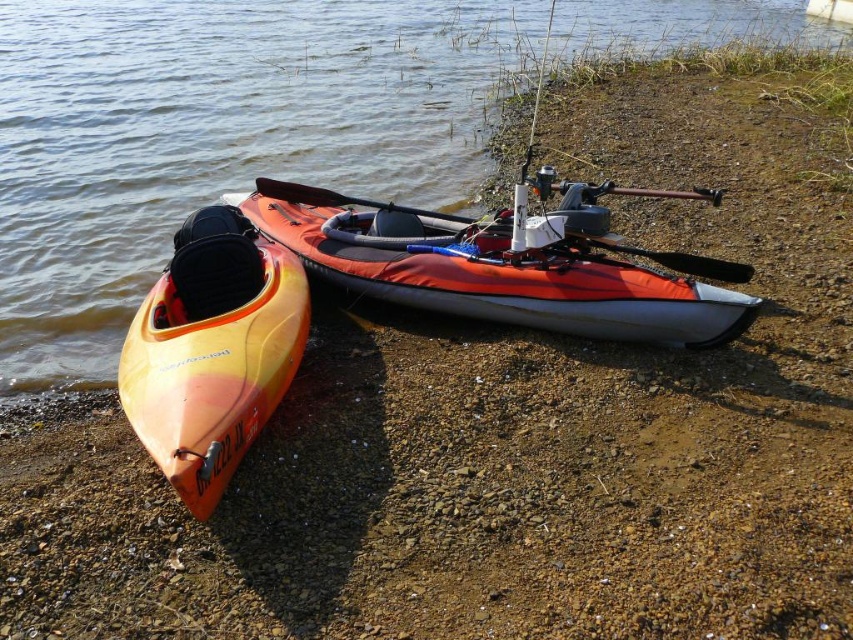
Question: Does orange kayak at lower left appear under orange fabric canoe at center?

Choices:
 (A) no
 (B) yes

Answer: (A)

Question: Observing the image, what is the correct spatial positioning of orange kayak at lower left in reference to orange matte kayak at left?

Choices:
 (A) right
 (B) left

Answer: (B)

Question: Is orange kayak at lower left bigger than orange matte kayak at left?

Choices:
 (A) no
 (B) yes

Answer: (B)

Question: Estimate the real-world distances between objects in this image. Which object is farther from the orange matte kayak at left?

Choices:
 (A) orange fabric canoe at center
 (B) orange kayak at lower left

Answer: (B)

Question: Which object is positioned closest to the orange kayak at lower left?

Choices:
 (A) orange matte kayak at left
 (B) orange fabric canoe at center

Answer: (B)

Question: Which point appears farthest from the camera in this image?

Choices:
 (A) (119, 321)
 (B) (370, 236)

Answer: (A)